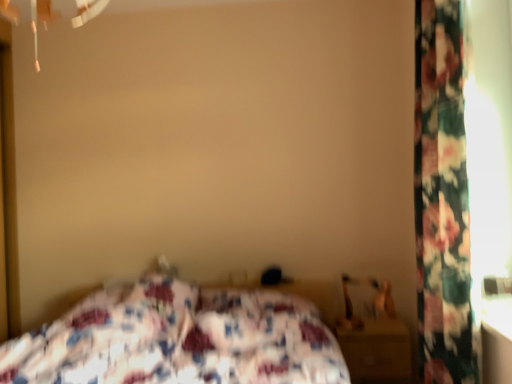
Question: Should I look upward or downward to see wooden nightstand at lower right?

Choices:
 (A) down
 (B) up

Answer: (A)

Question: Is floral fabric curtain at right wider than floral fabric bed at center?

Choices:
 (A) no
 (B) yes

Answer: (A)

Question: Is floral fabric curtain at right thinner than floral fabric bed at center?

Choices:
 (A) yes
 (B) no

Answer: (A)

Question: Is floral fabric curtain at right next to floral fabric bed at center and touching it?

Choices:
 (A) yes
 (B) no

Answer: (B)

Question: Is floral fabric curtain at right not within floral fabric bed at center?

Choices:
 (A) no
 (B) yes

Answer: (B)

Question: Considering the relative positions of floral fabric curtain at right and floral fabric bed at center in the image provided, is floral fabric curtain at right to the right of floral fabric bed at center from the viewer's perspective?

Choices:
 (A) no
 (B) yes

Answer: (B)

Question: Is floral fabric curtain at right looking in the opposite direction of floral fabric bed at center?

Choices:
 (A) yes
 (B) no

Answer: (B)

Question: Could you tell me if floral fabric curtain at right is turned towards wooden nightstand at lower right?

Choices:
 (A) yes
 (B) no

Answer: (B)

Question: Is floral fabric curtain at right wider than wooden nightstand at lower right?

Choices:
 (A) yes
 (B) no

Answer: (B)

Question: Considering the relative sizes of floral fabric curtain at right and wooden nightstand at lower right in the image provided, is floral fabric curtain at right thinner than wooden nightstand at lower right?

Choices:
 (A) no
 (B) yes

Answer: (B)

Question: From the image's perspective, is floral fabric curtain at right on wooden nightstand at lower right?

Choices:
 (A) no
 (B) yes

Answer: (B)

Question: Is floral fabric curtain at right at the left side of wooden nightstand at lower right?

Choices:
 (A) no
 (B) yes

Answer: (A)

Question: Is floral fabric curtain at right turned away from wooden nightstand at lower right?

Choices:
 (A) yes
 (B) no

Answer: (B)

Question: Considering the relative sizes of floral fabric bed at center and floral fabric curtain at right in the image provided, is floral fabric bed at center shorter than floral fabric curtain at right?

Choices:
 (A) no
 (B) yes

Answer: (B)